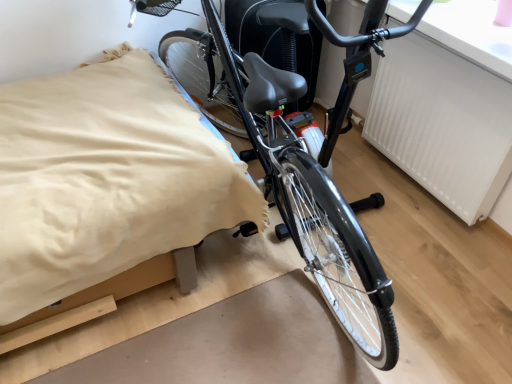
Find the location of a particular element. free spot in front of white textured radiator at upper right is located at coordinates (431, 245).